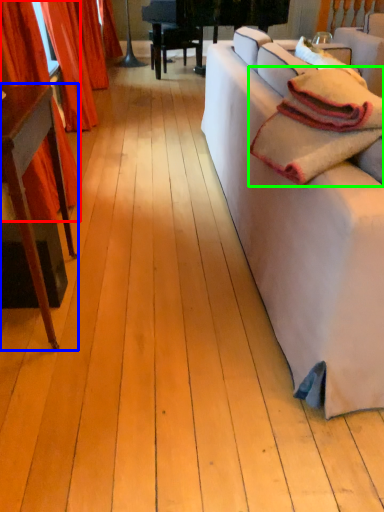
Question: Which object is the closest to the curtain (highlighted by a red box)? Choose among these: table (highlighted by a blue box) or blanket (highlighted by a green box).

Choices:
 (A) table
 (B) blanket

Answer: (A)